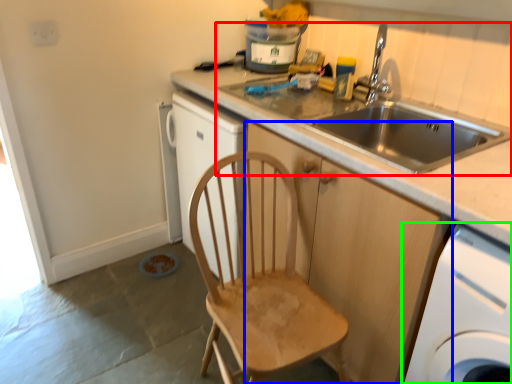
Question: Which object is positioned closest to sink (highlighted by a red box)? Select from cabinetry (highlighted by a blue box) and home appliance (highlighted by a green box).

Choices:
 (A) cabinetry
 (B) home appliance

Answer: (A)